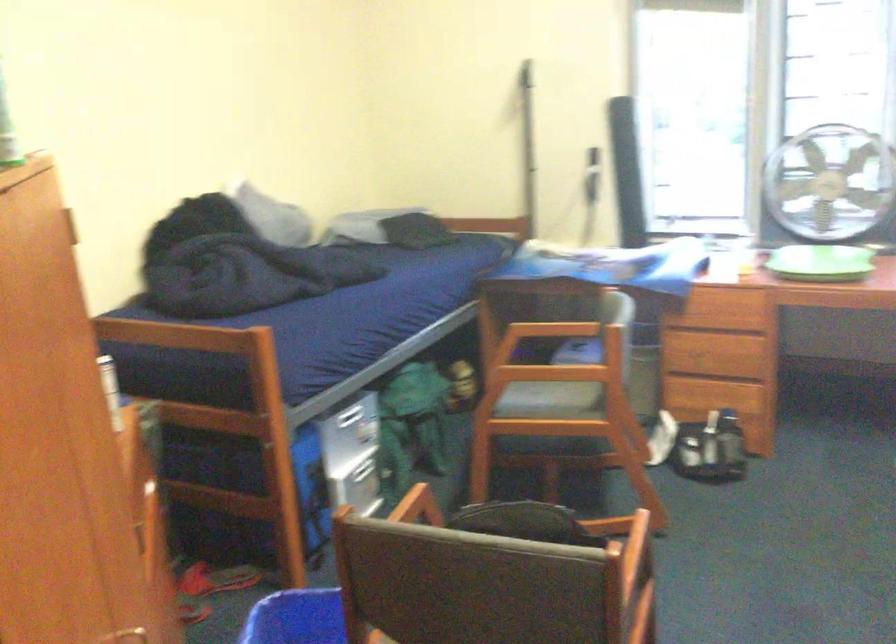
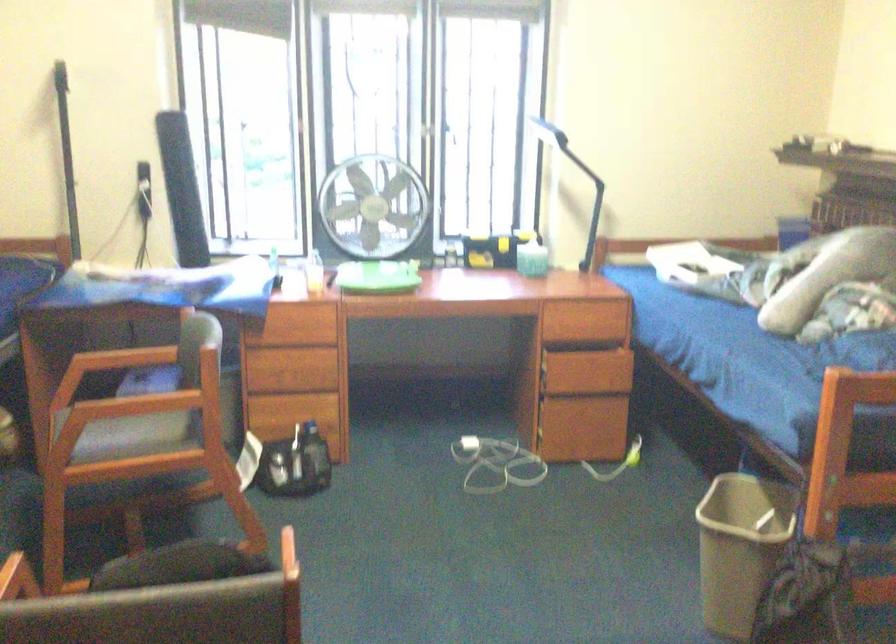
Find the pixel in the second image that matches the point at 570,393 in the first image.

(156, 427)